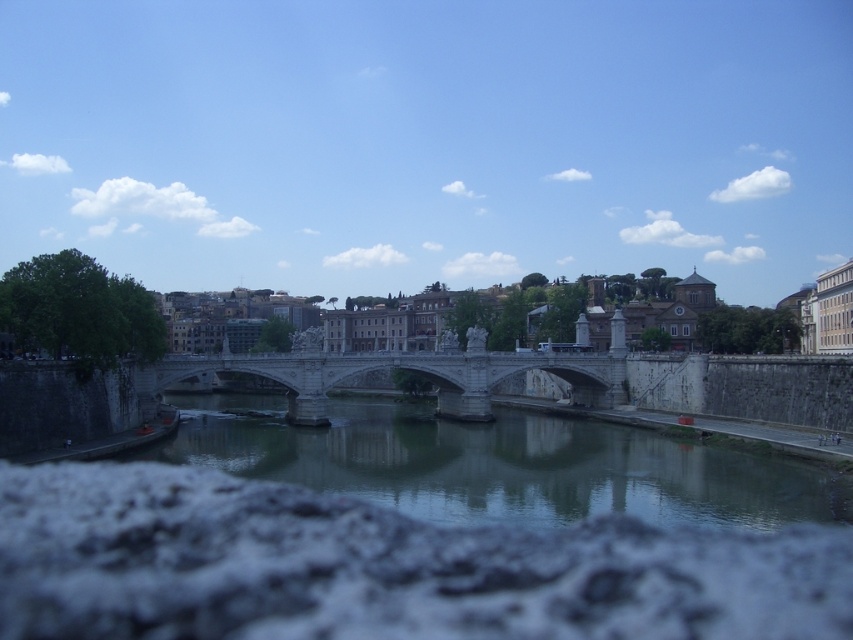
Question: Is smooth concrete river at center positioned behind stone bridge at center?

Choices:
 (A) yes
 (B) no

Answer: (B)

Question: Which object is closer to the camera taking this photo?

Choices:
 (A) stone bridge at center
 (B) smooth concrete river at center

Answer: (B)

Question: Can you confirm if smooth concrete river at center is smaller than stone bridge at center?

Choices:
 (A) yes
 (B) no

Answer: (B)

Question: Which of the following is the farthest from the observer?

Choices:
 (A) smooth concrete river at center
 (B) stone bridge at center

Answer: (B)

Question: Which of the following is the closest to the observer?

Choices:
 (A) (752, 458)
 (B) (144, 380)

Answer: (A)

Question: Is smooth concrete river at center above stone bridge at center?

Choices:
 (A) yes
 (B) no

Answer: (B)